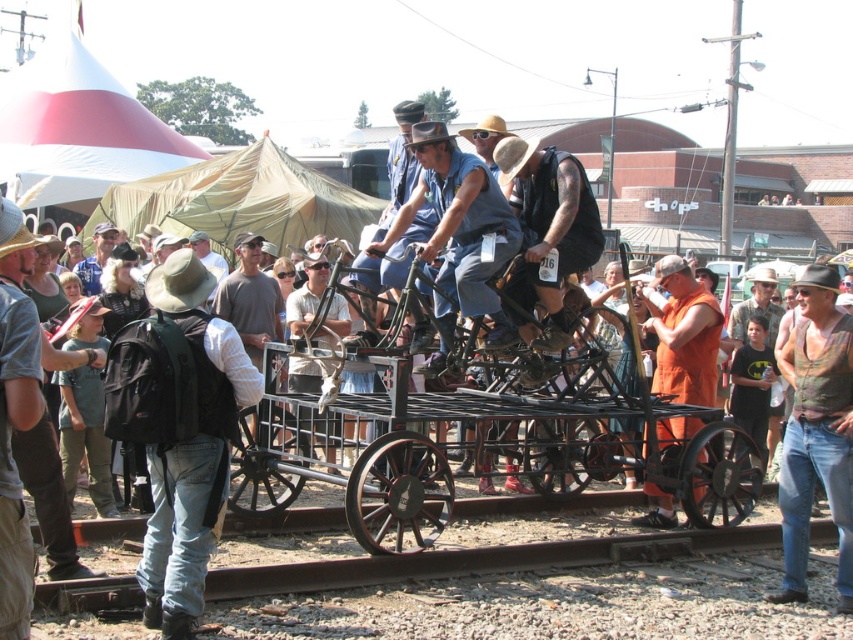
Can you confirm if metal at lower left is thinner than brown canvas backpack at left?

No.

Between point (657, 541) and point (25, 243), which one is positioned in front?

Point (25, 243) is in front.

The width and height of the screenshot is (853, 640). Find the location of `metal at lower left`. metal at lower left is located at coordinates point(479,561).

This screenshot has height=640, width=853. What do you see at coordinates (492, 449) in the screenshot?
I see `black metal wagon at center` at bounding box center [492, 449].

Find the location of a particular element. The height and width of the screenshot is (640, 853). black metal wagon at center is located at coordinates (492, 449).

Image resolution: width=853 pixels, height=640 pixels. Describe the element at coordinates (683, 333) in the screenshot. I see `orange fabric at center` at that location.

What are the coordinates of `orange fabric at center` in the screenshot? It's located at (683, 333).

Which is in front, point (677, 396) or point (309, 259)?

Point (677, 396) is in front.

Locate an element on the screen. The height and width of the screenshot is (640, 853). orange fabric at center is located at coordinates (683, 333).